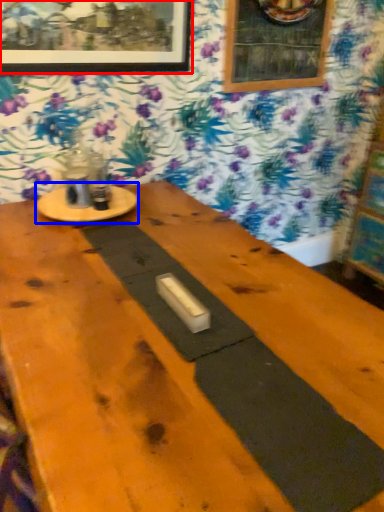
Question: Which object appears closest to the camera in this image, picture frame (highlighted by a red box) or round table (highlighted by a blue box)?

Choices:
 (A) picture frame
 (B) round table

Answer: (A)